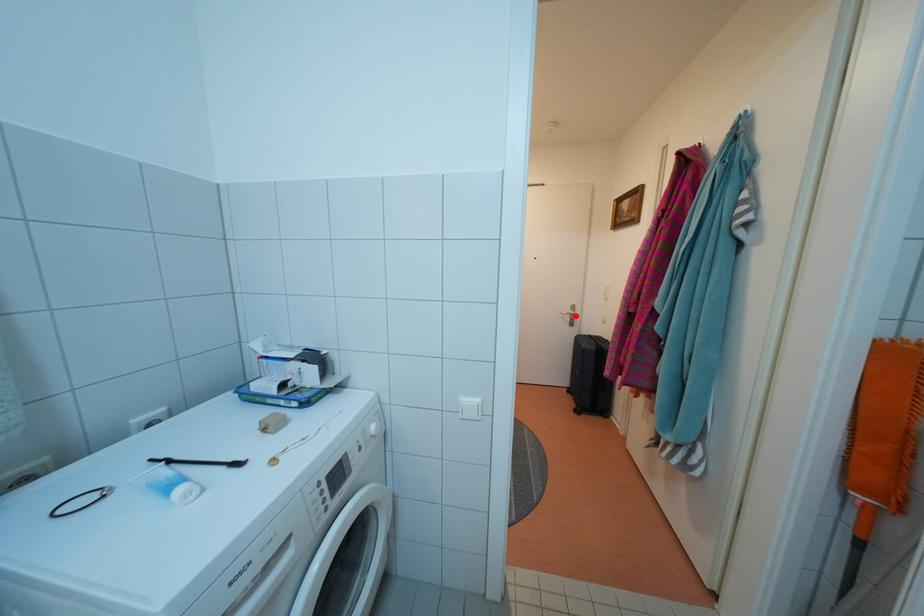
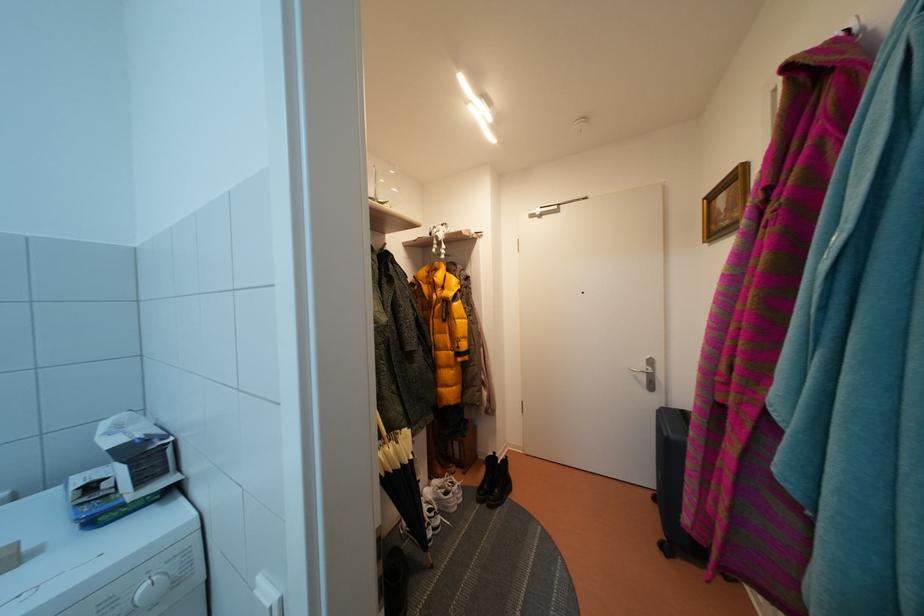
In the second image, find the point that corresponds to the highlighted location in the first image.

(650, 371)